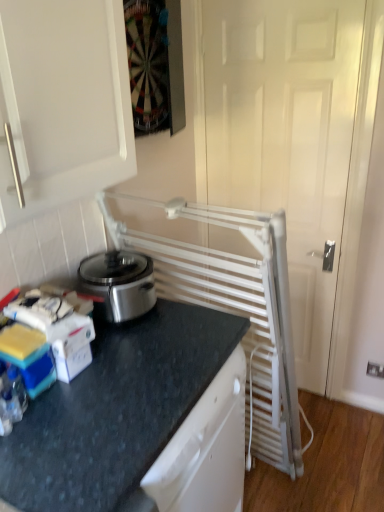
At what (x,y) coordinates should I click in order to perform the action: click on black granite countertop at lower left. Please return your answer as a coordinate pair (x, y). Looking at the image, I should click on (136, 419).

In the image, is white metallic radiator at right positioned in front of or behind black granite countertop at lower left?

Clearly, white metallic radiator at right is behind black granite countertop at lower left.

Does white metallic radiator at right have a lesser width compared to black granite countertop at lower left?

Yes.

Is white metallic radiator at right looking in the opposite direction of black granite countertop at lower left?

No.

Can you confirm if white metallic radiator at right is positioned to the right of black granite countertop at lower left?

Correct, you'll find white metallic radiator at right to the right of black granite countertop at lower left.

Which is in front, white plastic electric outlet at lower right or white metallic radiator at right?

white metallic radiator at right is more forward.

From the image's perspective, is white plastic electric outlet at lower right over white metallic radiator at right?

No, from the image's perspective, white plastic electric outlet at lower right is not over white metallic radiator at right.

Is white plastic electric outlet at lower right situated inside white metallic radiator at right or outside?

white plastic electric outlet at lower right is not enclosed by white metallic radiator at right.

I want to click on screen door located above the white plastic electric outlet at lower right (from the image's perspective), so click(x=286, y=138).

Considering the sizes of white metallic radiator at right and white plastic electric outlet at lower right in the image, is white metallic radiator at right bigger or smaller than white plastic electric outlet at lower right?

white metallic radiator at right is bigger than white plastic electric outlet at lower right.

Is white metallic radiator at right oriented towards white plastic electric outlet at lower right?

No, white metallic radiator at right is not aimed at white plastic electric outlet at lower right.

How different are the orientations of white metallic radiator at right and white plastic electric outlet at lower right in degrees?

There is a 0.426-degree angle between the facing directions of white metallic radiator at right and white plastic electric outlet at lower right.

Looking at this image, is white plastic electric outlet at lower right a part of white metallic radiator at right?

No, white plastic electric outlet at lower right is not a part of white metallic radiator at right.

Where is `electric outlet that is above the black granite countertop at lower left (from the image's perspective)`? The width and height of the screenshot is (384, 512). electric outlet that is above the black granite countertop at lower left (from the image's perspective) is located at coordinates [375, 370].

Can you tell me how much black granite countertop at lower left and white plastic electric outlet at lower right differ in facing direction?

There is a 91.2-degree angle between the facing directions of black granite countertop at lower left and white plastic electric outlet at lower right.

Which of these two, black granite countertop at lower left or white plastic electric outlet at lower right, stands taller?

With more height is black granite countertop at lower left.

From the image's perspective, which object appears higher, black granite countertop at lower left or white plastic electric outlet at lower right?

white plastic electric outlet at lower right.

Is black granite countertop at lower left wider than white metallic radiator at right?

Correct, the width of black granite countertop at lower left exceeds that of white metallic radiator at right.

From a real-world perspective, is black granite countertop at lower left above or below white metallic radiator at right?

Clearly, from a real-world perspective, black granite countertop at lower left is below white metallic radiator at right.

Can you tell me how much black granite countertop at lower left and white metallic radiator at right differ in facing direction?

There is a 91.6-degree angle between the facing directions of black granite countertop at lower left and white metallic radiator at right.

From the image's perspective, which is above, black granite countertop at lower left or white metallic radiator at right?

white metallic radiator at right appears higher in the image.

Who is bigger, white plastic electric outlet at lower right or black granite countertop at lower left?

Bigger between the two is black granite countertop at lower left.

Do you think white plastic electric outlet at lower right is within black granite countertop at lower left, or outside of it?

white plastic electric outlet at lower right is not enclosed by black granite countertop at lower left.

Locate an element on the screen. This screenshot has width=384, height=512. electric outlet above the black granite countertop at lower left (from the image's perspective) is located at coordinates (375, 370).

You are a GUI agent. You are given a task and a screenshot of the screen. Output one action in this format:
    pyautogui.click(x=<x>, y=<y>)
    Task: Click on the screen door located above the black granite countertop at lower left (from a real-world perspective)
    This screenshot has height=512, width=384.
    Given the screenshot: What is the action you would take?
    pyautogui.click(x=286, y=138)

Locate an element on the screen. The height and width of the screenshot is (512, 384). screen door on the left of white plastic electric outlet at lower right is located at coordinates (286, 138).

Based on their spatial positions, is black granite countertop at lower left or white metallic radiator at right closer to white plastic electric outlet at lower right?

Result: Based on the image, white metallic radiator at right appears to be nearer to white plastic electric outlet at lower right.

Estimate the real-world distances between objects in this image. Which object is further from white metallic radiator at right, black granite countertop at lower left or white plastic electric outlet at lower right?

Based on the image, white plastic electric outlet at lower right appears to be further to white metallic radiator at right.

When comparing their distances from black granite countertop at lower left, does white metallic radiator at right or white plastic electric outlet at lower right seem closer?

white metallic radiator at right.

Which object lies further to the anchor point white metallic radiator at right, white plastic electric outlet at lower right or black granite countertop at lower left?

white plastic electric outlet at lower right.

Estimate the real-world distances between objects in this image. Which object is further from white plastic electric outlet at lower right, white metallic radiator at right or black granite countertop at lower left?

black granite countertop at lower left is positioned further to the anchor white plastic electric outlet at lower right.

When comparing their distances from black granite countertop at lower left, does white plastic electric outlet at lower right or white metallic radiator at right seem further?

The object further to black granite countertop at lower left is white plastic electric outlet at lower right.

At what (x,y) coordinates should I click in order to perform the action: click on screen door between black granite countertop at lower left and white plastic electric outlet at lower right along the z-axis. Please return your answer as a coordinate pair (x, y). Looking at the image, I should click on (286, 138).